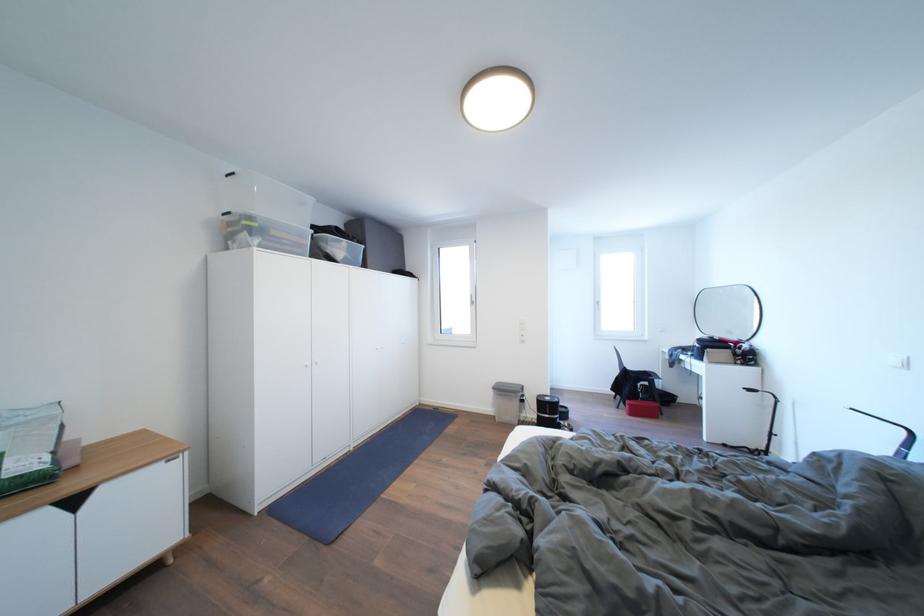
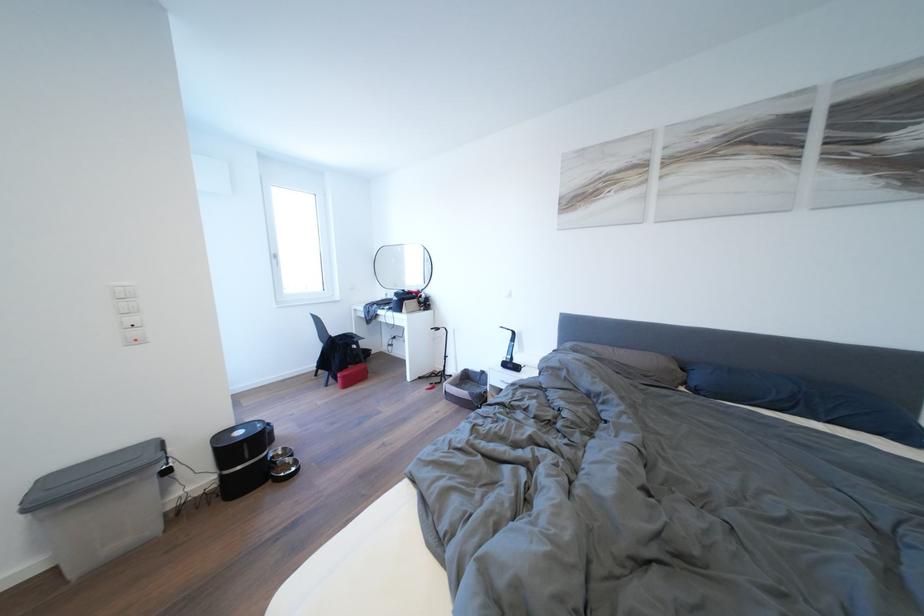
Where in the second image is the point corresponding to pixel 555 403 from the first image?

(248, 438)